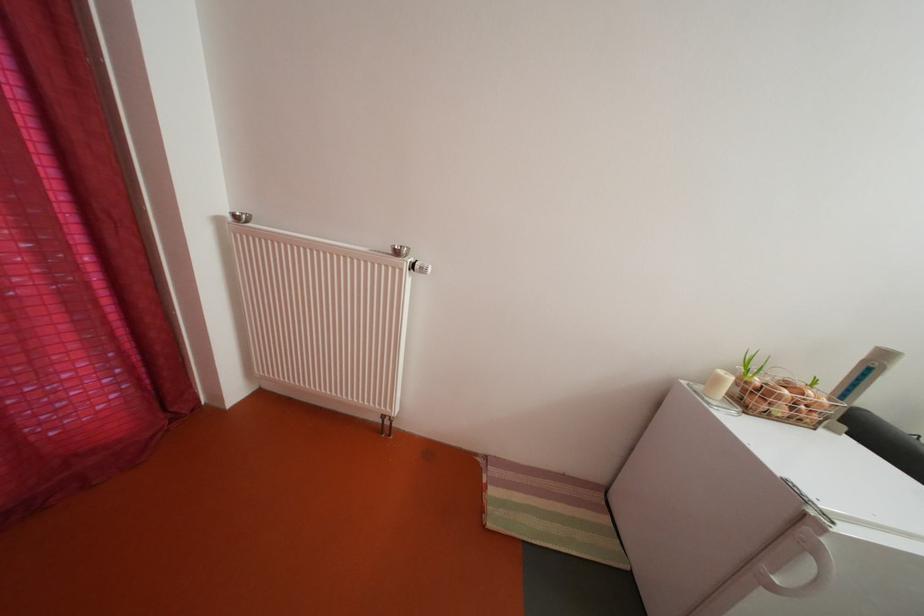
This screenshot has height=616, width=924. What are the coordinates of `wire basket` in the screenshot? It's located at (785, 395).